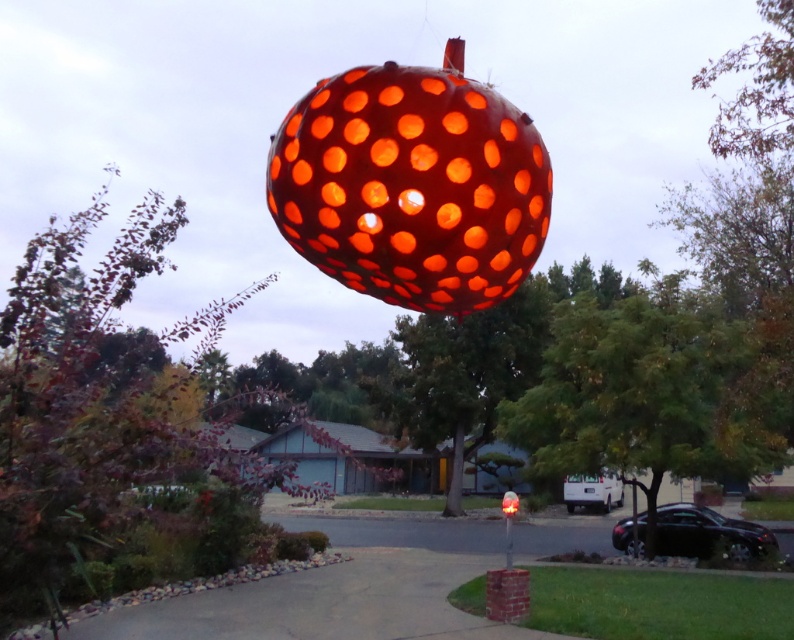
You are standing in front of the translucent orange sphere at center and want to walk towards the house behind it. Which direction should you move relative to the green leafy tree at upper center?

To walk towards the house behind the translucent orange sphere at center, you should move to the right relative to the green leafy tree at upper center since the tree is to the left of the sphere, and the house is behind the sphere.

You are standing in front of the pumpkin display and want to place a small decoration at point (410,168). If the decoration requires a distance of at least 7 feet from the viewer to be visible, will it be visible from where you are standing?

The distance of point (410,168) from viewer is 8.16 feet, which is greater than the required 7 feet. Therefore, the decoration placed at point (410,168) will be visible from your current position.

You are standing in the front yard of the house and want to place a new garden statue that is 2 meters tall. The translucent orange sphere at center is in your way. Can you move the statue to the spot where the green leafy tree at center is currently located without disturbing the sphere?

The translucent orange sphere at center is located above the green leafy tree at center. Since the sphere is above the tree, moving the statue to the tree location would not interfere with the sphere as it is elevated. The statue can be placed there.